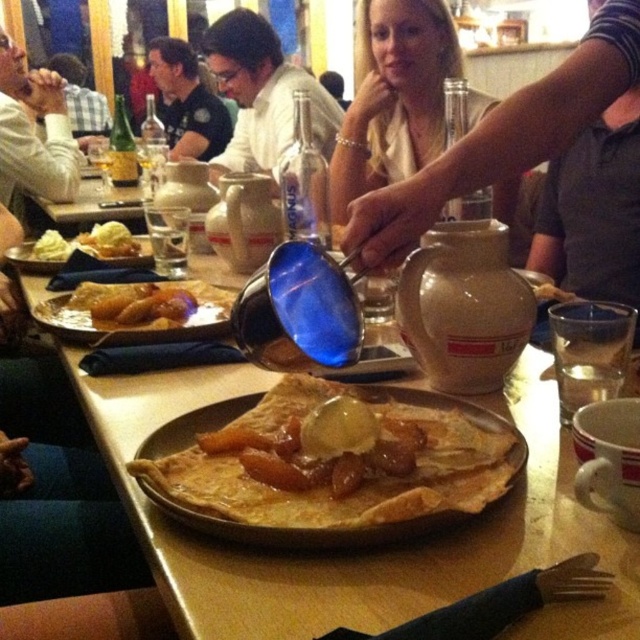
Does matte ceramic plate at center have a lesser height compared to golden crispy crepe at center?

No.

Is point (493, 515) more distant than point (198, 515)?

Yes, point (493, 515) is behind point (198, 515).

Where is `matte ceramic plate at center`? matte ceramic plate at center is located at coordinates (364, 552).

Consider the image. Can you confirm if smooth beige teapot at center is positioned below white creamy ice cream at center?

No.

Does smooth beige teapot at center have a greater height compared to white creamy ice cream at center?

Correct, smooth beige teapot at center is much taller as white creamy ice cream at center.

What do you see at coordinates (394, 97) in the screenshot? The image size is (640, 640). I see `smooth beige teapot at center` at bounding box center [394, 97].

Find the location of a particular element. This screenshot has height=640, width=640. smooth beige teapot at center is located at coordinates (394, 97).

Does golden crispy crepe at center appear under smooth beige teapot at center?

Correct, golden crispy crepe at center is located below smooth beige teapot at center.

Does golden crispy crepe at center have a smaller size compared to smooth beige teapot at center?

Yes, golden crispy crepe at center is smaller than smooth beige teapot at center.

Is point (289, 403) farther from camera compared to point (454, 49)?

No.

Locate an element on the screen. Image resolution: width=640 pixels, height=640 pixels. golden crispy crepe at center is located at coordinates (326, 486).